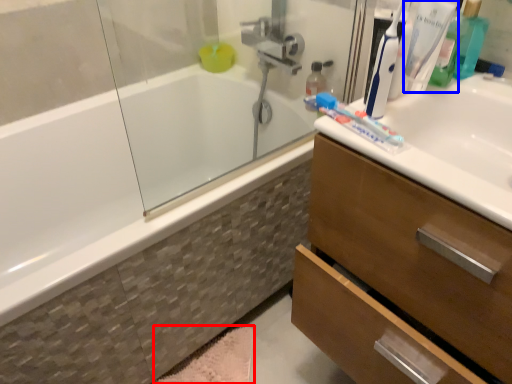
Question: Which object appears closest to the camera in this image, bath mat (highlighted by a red box) or toothbrush (highlighted by a blue box)?

Choices:
 (A) bath mat
 (B) toothbrush

Answer: (B)